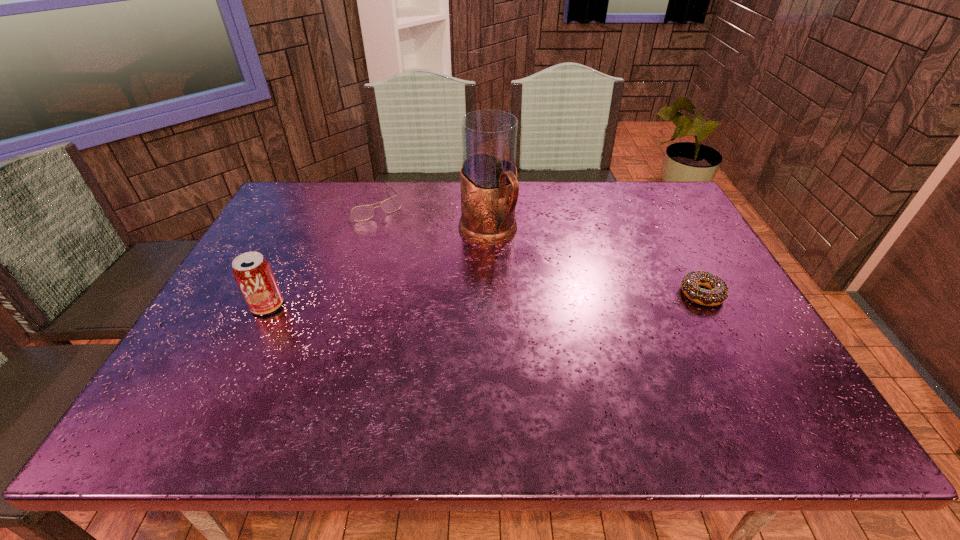
At what (x,y) coordinates should I click in order to perform the action: click on free space on the desktop that is between the soda can and the doughnut and is positioned with the handle on the side of the third object from left to right. Please return your answer as a coordinate pair (x, y). This screenshot has width=960, height=540. Looking at the image, I should click on (545, 298).

Image resolution: width=960 pixels, height=540 pixels. I want to click on free spot on the desktop that is between the second tallest object and the shortest object and is positioned on the front-facing side of the third tallest object, so click(x=441, y=301).